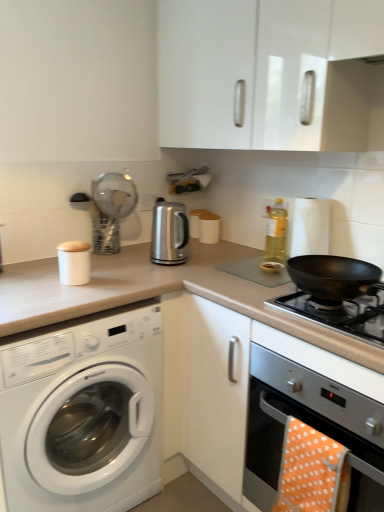
The image size is (384, 512). I want to click on free spot in front of metal mesh strainer at upper center, the third appliance when ordered from right to left, so click(x=119, y=262).